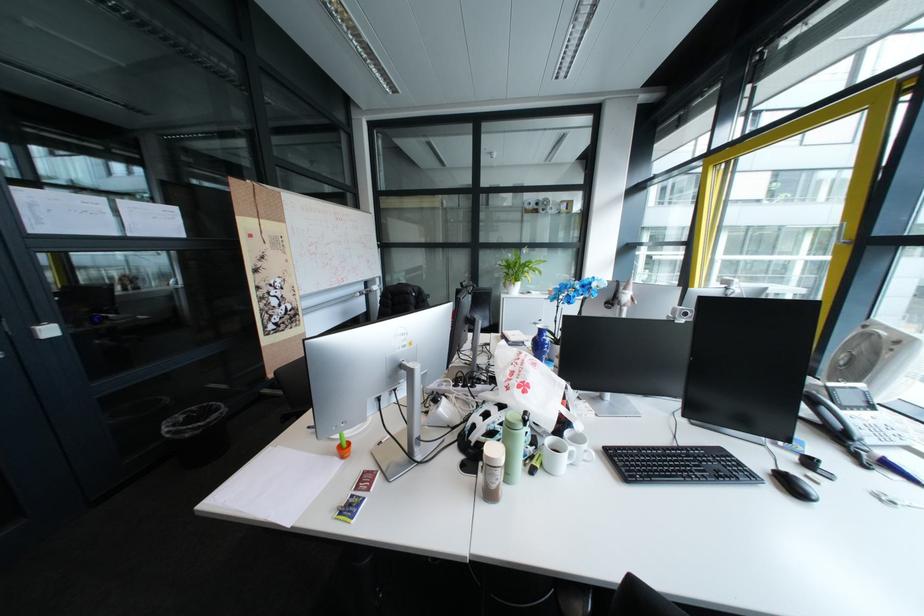
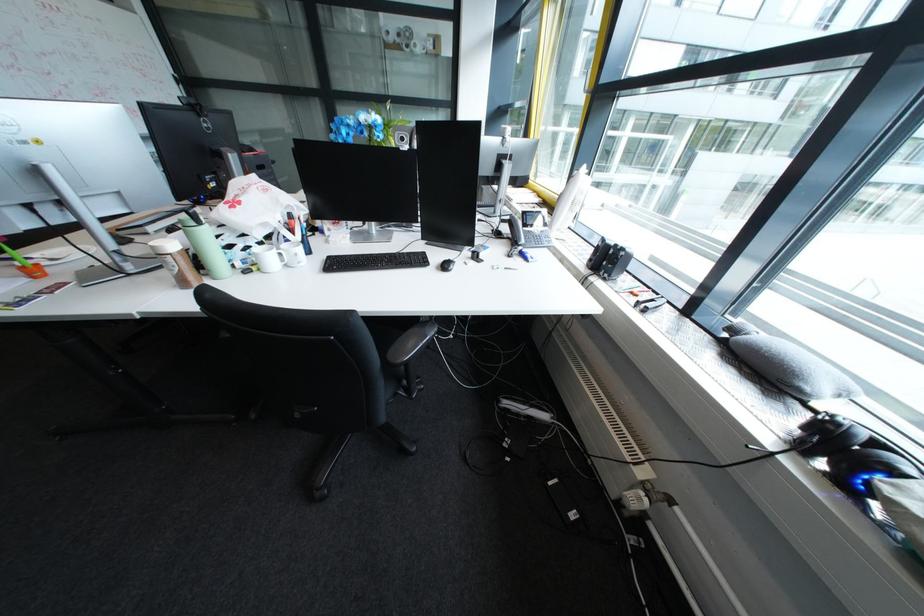
Find the pixel in the second image that matches the point at 507,484 in the first image.

(187, 270)